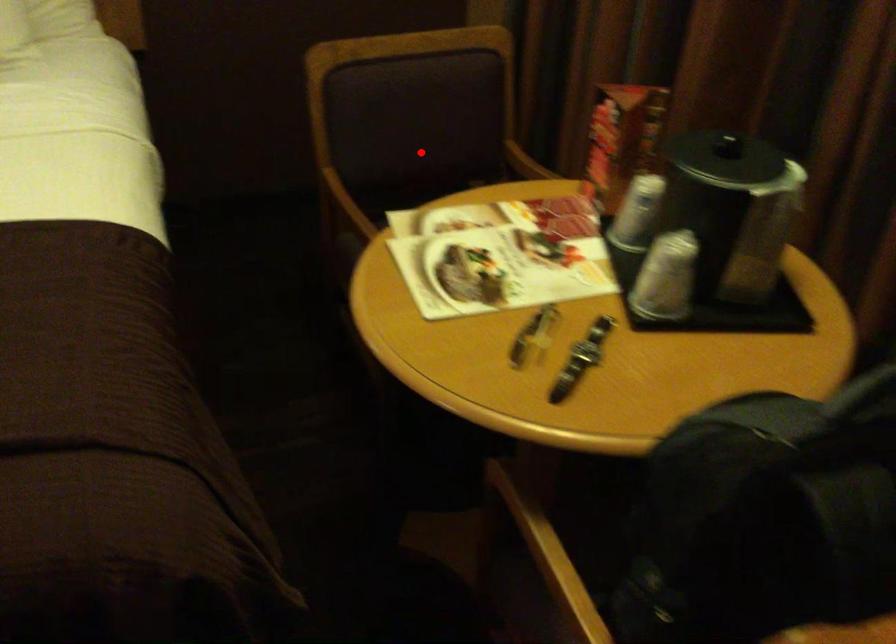
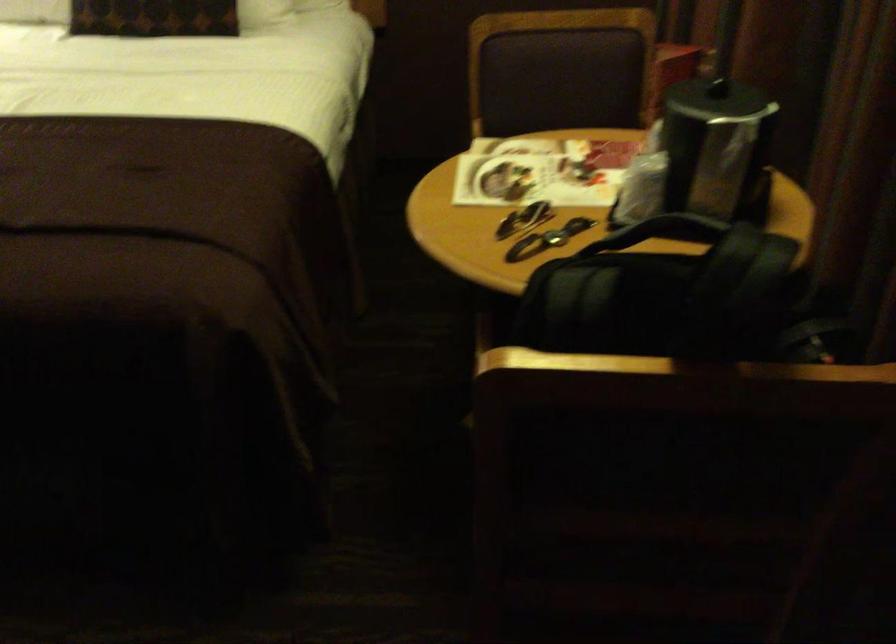
Locate, in the second image, the point that corresponds to the highlighted location in the first image.

(553, 113)